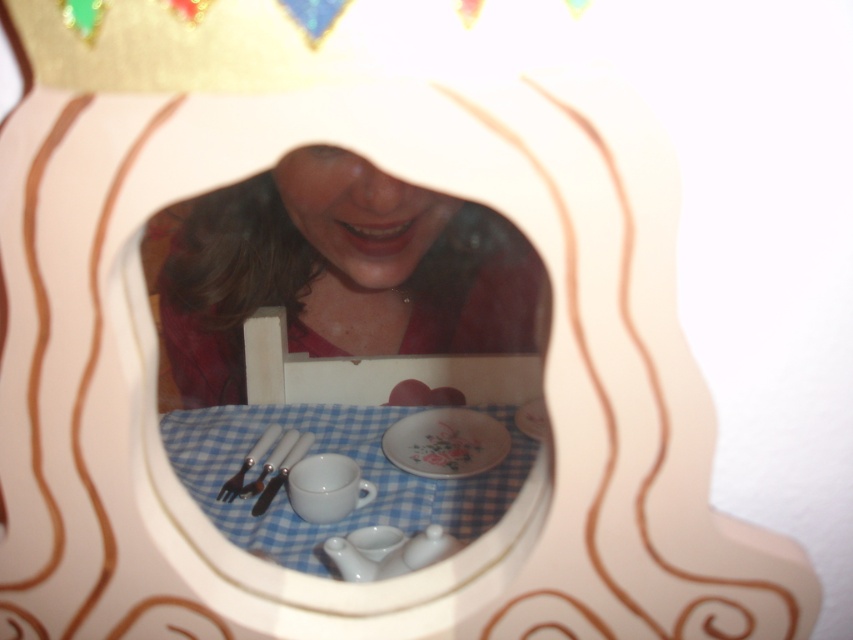
Question: Which object appears closest to the camera in this image?

Choices:
 (A) blue checkered tablecloth at center
 (B) floral porcelain plate at center
 (C) white glossy mirror at center

Answer: (A)

Question: Observing the image, what is the correct spatial positioning of floral porcelain plate at center in reference to satin silver fork at lower center?

Choices:
 (A) below
 (B) above

Answer: (B)

Question: Which object is closer to the camera taking this photo?

Choices:
 (A) satin silver fork at lower center
 (B) blue checkered tablecloth at center
 (C) floral porcelain plate at center
 (D) white glossy mirror at center

Answer: (B)

Question: Is white glossy mirror at center wider than satin silver fork at lower center?

Choices:
 (A) no
 (B) yes

Answer: (B)

Question: Can you confirm if blue checkered tablecloth at center is wider than floral porcelain plate at center?

Choices:
 (A) no
 (B) yes

Answer: (B)

Question: Which object is farther from the camera taking this photo?

Choices:
 (A) white glossy mirror at center
 (B) floral porcelain plate at center
 (C) satin silver fork at lower center
 (D) blue checkered tablecloth at center

Answer: (B)